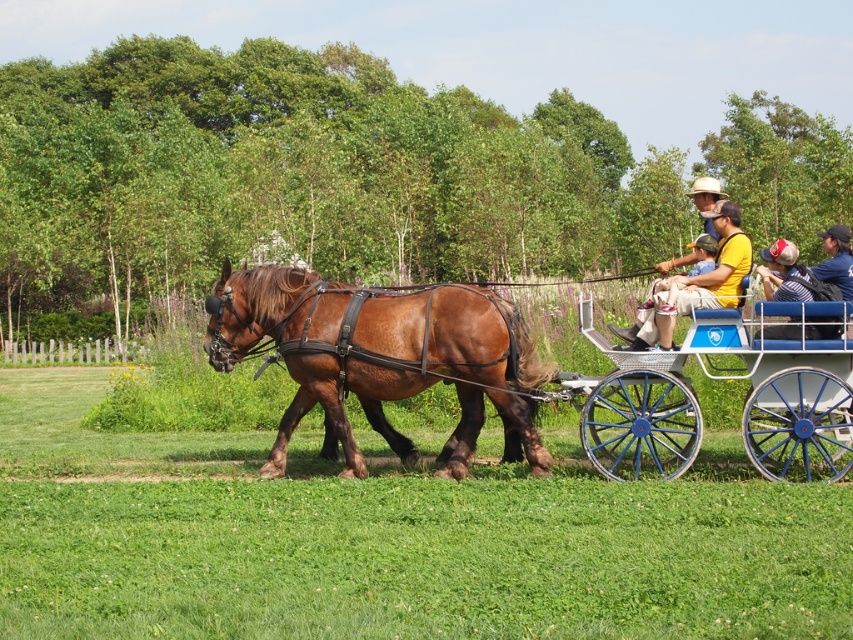
You are a photographer standing at the edge of the path in the park. You want to take a photo of both the denim jacket at center and the matte brown horse at center. Since you have a camera with a fixed focal length, you need to adjust your position to ensure both objects are in frame. Based on their sizes, which object should you focus on to include both in the shot?

The denim jacket at center is smaller than the matte brown horse at center, so you should focus on the matte brown horse at center to ensure both are in frame.